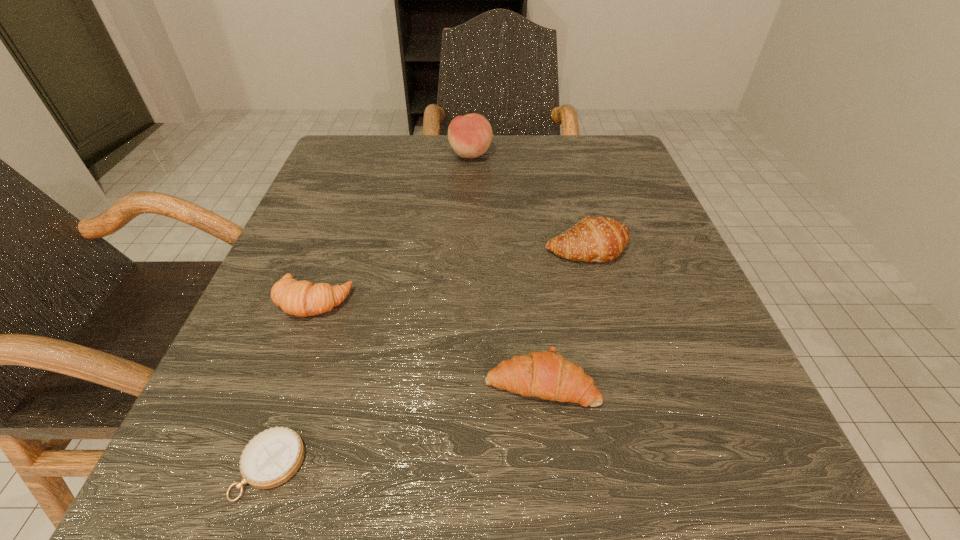
Identify the location of free space at the far edge of the desktop. Image resolution: width=960 pixels, height=540 pixels. (469, 181).

The image size is (960, 540). Identify the location of blank space at the near edge of the desktop. (436, 522).

In the image, there is a desktop. Identify the location of vacant space at the left edge. (244, 328).

In the image, there is a desktop. At what (x,y) coordinates should I click in order to perform the action: click on blank space at the far left corner. Please return your answer as a coordinate pair (x, y). Looking at the image, I should click on (379, 163).

Locate an element on the screen. The width and height of the screenshot is (960, 540). free region at the near left corner of the desktop is located at coordinates pos(180,503).

You are a GUI agent. You are given a task and a screenshot of the screen. Output one action in this format:
    pyautogui.click(x=<x>, y=<y>)
    Task: Click on the vacant space at the far right corner
    Image resolution: width=960 pixels, height=540 pixels.
    Given the screenshot: What is the action you would take?
    pyautogui.click(x=619, y=151)

You are a GUI agent. You are given a task and a screenshot of the screen. Output one action in this format:
    pyautogui.click(x=<x>, y=<y>)
    Task: Click on the vacant area that lies between the third farthest object and the fourth shortest object
    The image size is (960, 540).
    Given the screenshot: What is the action you would take?
    pyautogui.click(x=450, y=275)

This screenshot has height=540, width=960. Find the location of `unoccupied area between the leftmost crescent roll and the tallest object`. unoccupied area between the leftmost crescent roll and the tallest object is located at coordinates (392, 228).

At what (x,y) coordinates should I click in order to perform the action: click on free space between the nearest crescent roll and the farthest object. Please return your answer as a coordinate pair (x, y). The height and width of the screenshot is (540, 960). Looking at the image, I should click on (506, 268).

Image resolution: width=960 pixels, height=540 pixels. I want to click on empty location between the nearest crescent roll and the peach, so click(506, 268).